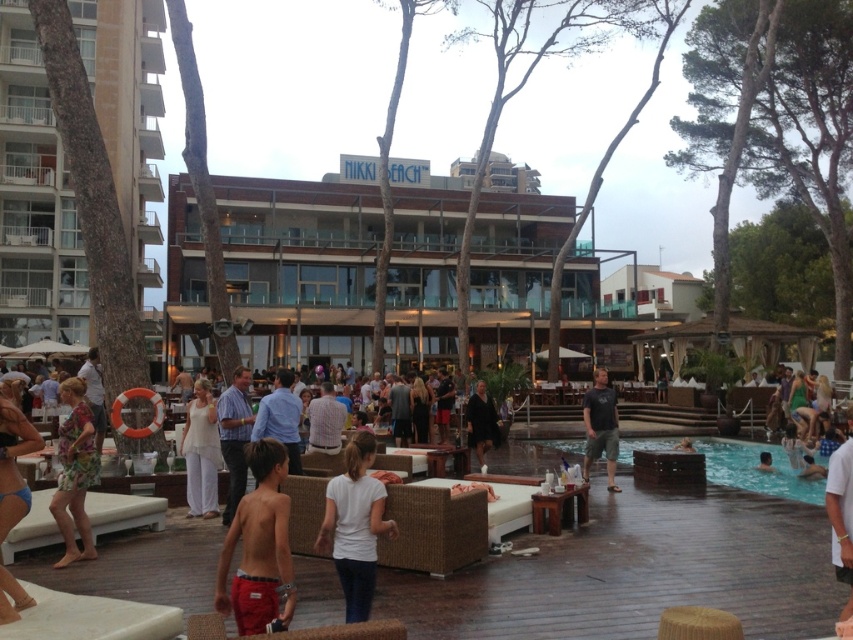
Between red cotton shorts at lower left and light blue shirt at center, which one is positioned lower?

light blue shirt at center is lower down.

Between red cotton shorts at lower left and light blue shirt at center, which one has less height?

With less height is light blue shirt at center.

The height and width of the screenshot is (640, 853). What are the coordinates of `red cotton shorts at lower left` in the screenshot? It's located at (259, 547).

In order to click on red cotton shorts at lower left in this screenshot , I will do [x=259, y=547].

Is point (3, 614) farther from camera compared to point (256, 412)?

No.

What do you see at coordinates (13, 465) in the screenshot? The height and width of the screenshot is (640, 853). I see `matte blue bikini at lower left` at bounding box center [13, 465].

Identify the location of matte blue bikini at lower left. (13, 465).

Which of these two, matte blue bikini at lower left or light blue fabric swimmer at lower right, stands shorter?

light blue fabric swimmer at lower right is shorter.

Does matte blue bikini at lower left have a greater height compared to light blue fabric swimmer at lower right?

Yes.

Locate an element on the screen. The height and width of the screenshot is (640, 853). matte blue bikini at lower left is located at coordinates (13, 465).

This screenshot has height=640, width=853. I want to click on matte blue bikini at lower left, so click(x=13, y=465).